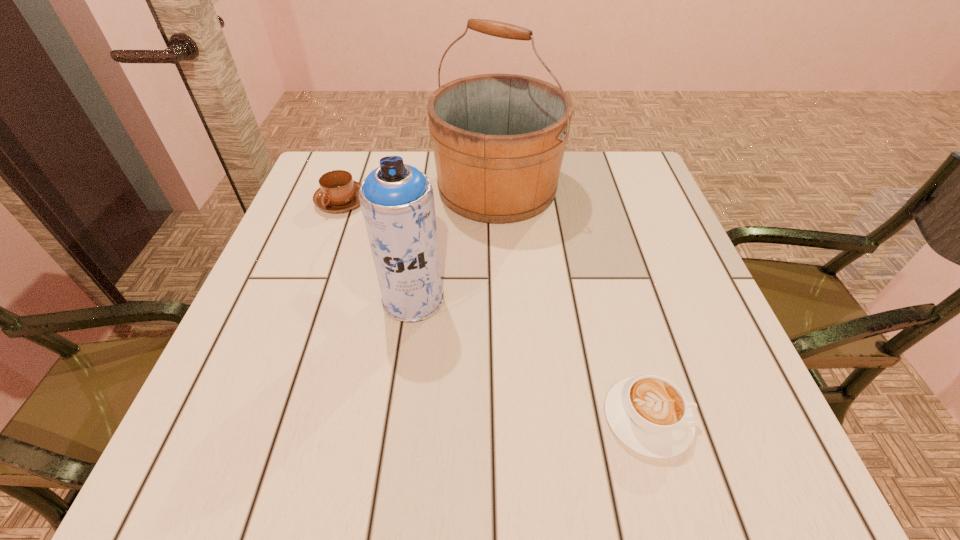
The width and height of the screenshot is (960, 540). Identify the location of the tallest object. (498, 139).

Find the location of a particular element. This screenshot has height=540, width=960. the third shortest object is located at coordinates (397, 200).

Locate an element on the screen. the third farthest object is located at coordinates (397, 200).

Where is `the farther cappuccino`? Image resolution: width=960 pixels, height=540 pixels. the farther cappuccino is located at coordinates (338, 192).

I want to click on the left cappuccino, so click(x=338, y=192).

The height and width of the screenshot is (540, 960). In order to click on the nearest object in this screenshot , I will do `click(649, 414)`.

Find the location of a particular element. This screenshot has width=960, height=540. the right cappuccino is located at coordinates (649, 414).

You are a GUI agent. You are given a task and a screenshot of the screen. Output one action in this format:
    pyautogui.click(x=<x>, y=<y>)
    Task: Click on the vacant point located on the front of the tallest object
    This screenshot has width=960, height=540.
    Given the screenshot: What is the action you would take?
    pyautogui.click(x=506, y=370)

Locate an element on the screen. vacant area situated on the right of the aerosol can is located at coordinates (536, 299).

Locate an element on the screen. free point located on the side of the leftmost object with the handle is located at coordinates (324, 249).